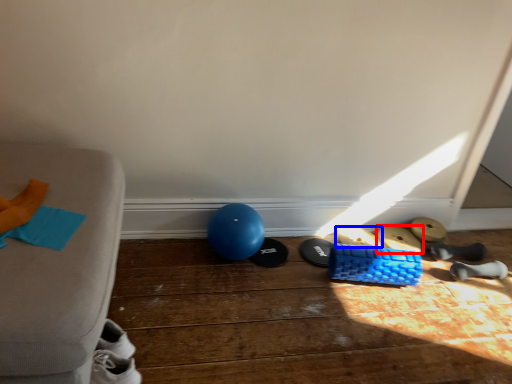
Question: Among these objects, which one is farthest to the camera, footwear (highlighted by a red box) or footwear (highlighted by a blue box)?

Choices:
 (A) footwear
 (B) footwear

Answer: (A)